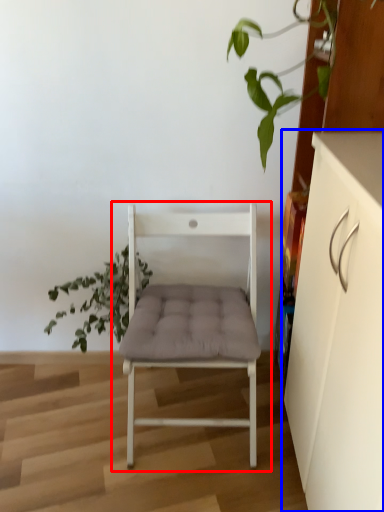
Question: Which of the following is the farthest to the observer, chair (highlighted by a red box) or cabinetry (highlighted by a blue box)?

Choices:
 (A) chair
 (B) cabinetry

Answer: (A)